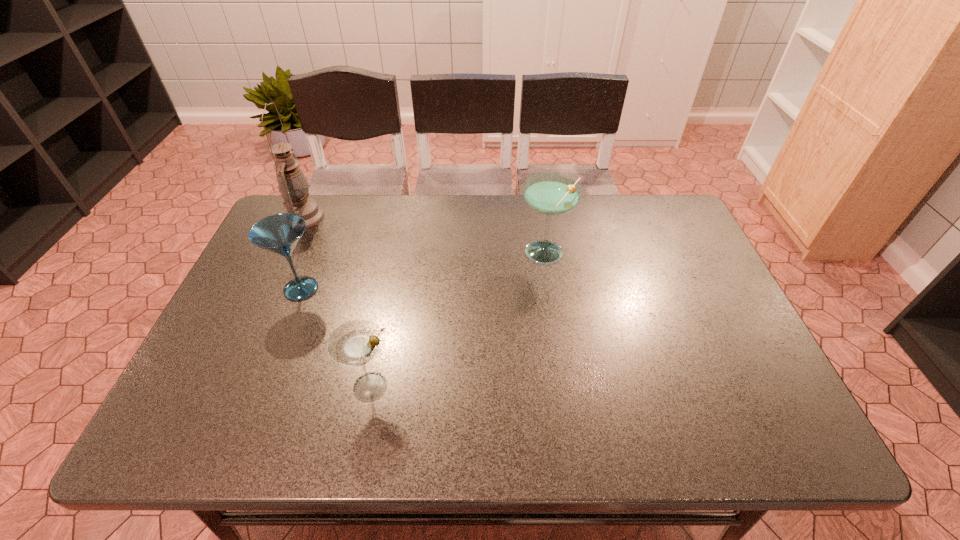
Identify the location of the farthest object. The height and width of the screenshot is (540, 960). (292, 183).

Find the location of `oil lamp`. oil lamp is located at coordinates (292, 183).

Find the location of a particular element. the rightmost object is located at coordinates (550, 193).

Find the location of `the leftmost martini`. the leftmost martini is located at coordinates (280, 233).

At what (x,y) coordinates should I click in order to perform the action: click on the second martini from left to right. Please return your answer as a coordinate pair (x, y). Looking at the image, I should click on (355, 343).

You are a GUI agent. You are given a task and a screenshot of the screen. Output one action in this format:
    pyautogui.click(x=<x>, y=<y>)
    Task: Click on the third object from left to right
    The image size is (960, 540).
    Given the screenshot: What is the action you would take?
    pyautogui.click(x=355, y=343)

Where is `vacant space located on the right of the farthest object`? This screenshot has width=960, height=540. vacant space located on the right of the farthest object is located at coordinates (380, 217).

Where is `free location located 0.280m on the front of the rightmost martini`? free location located 0.280m on the front of the rightmost martini is located at coordinates (562, 361).

Where is `vacant space located on the back of the leftmost martini`? This screenshot has height=540, width=960. vacant space located on the back of the leftmost martini is located at coordinates (326, 225).

Locate an element on the screen. This screenshot has width=960, height=540. free location located 0.190m on the back of the nearest object is located at coordinates (387, 303).